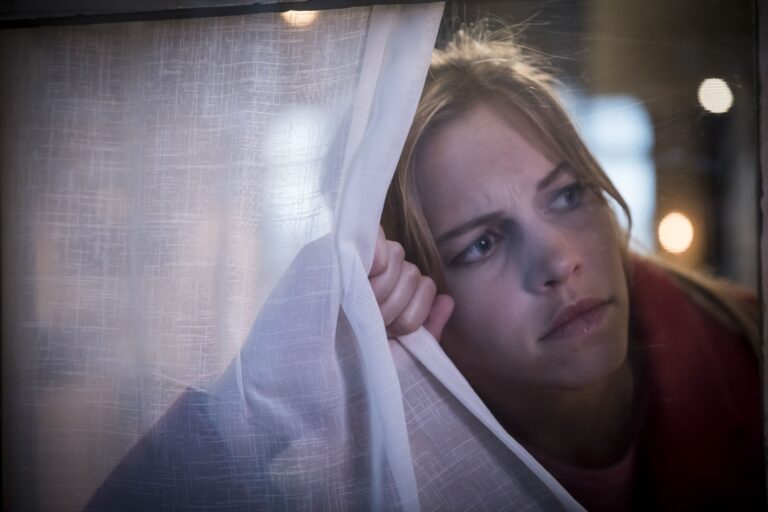
The image size is (768, 512). What are the coordinates of `sheer curtain` in the screenshot? It's located at (312, 213).